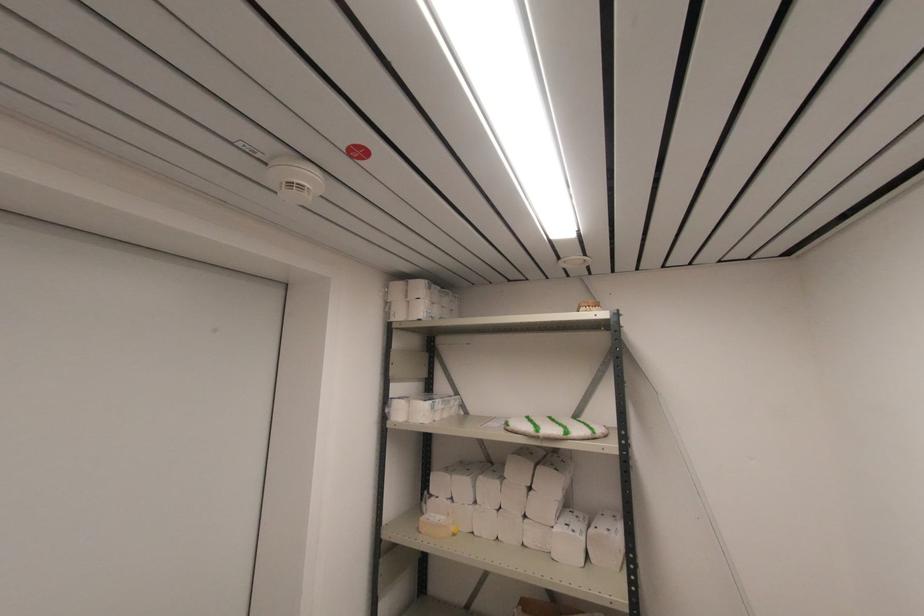
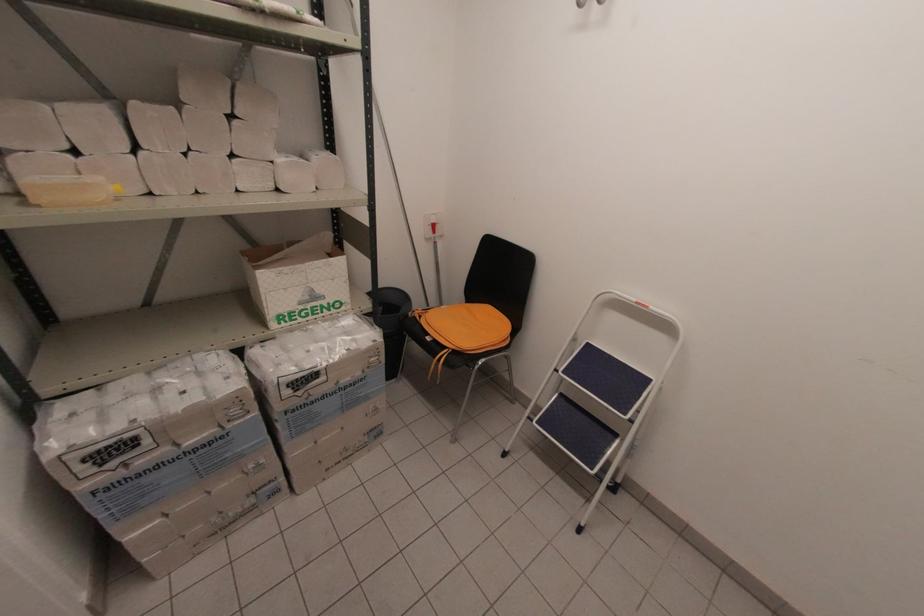
The point at (454, 530) is marked in the first image. Where is the corresponding point in the second image?

(116, 188)